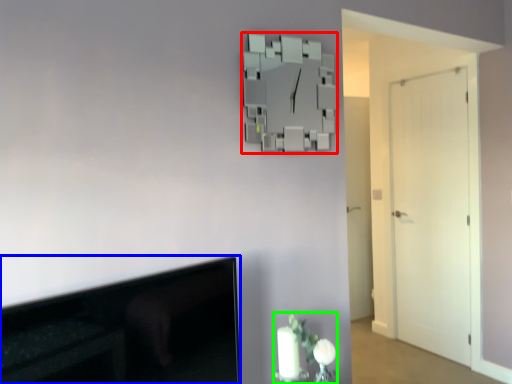
Question: Which object is positioned farthest from mirror (highlighted by a red box)? Select from television (highlighted by a blue box) and floral arrangement (highlighted by a green box).

Choices:
 (A) television
 (B) floral arrangement

Answer: (A)